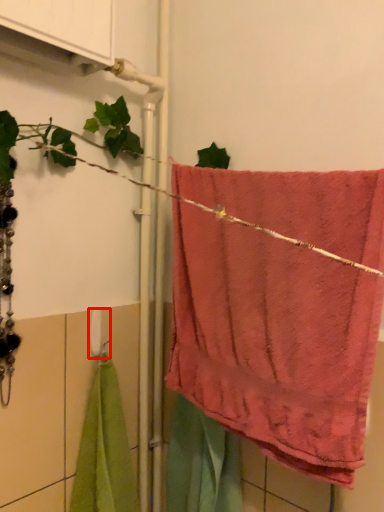
Question: From the image's perspective, where is towel bar (annotated by the red box) located in relation to towel in the image?

Choices:
 (A) above
 (B) below

Answer: (B)